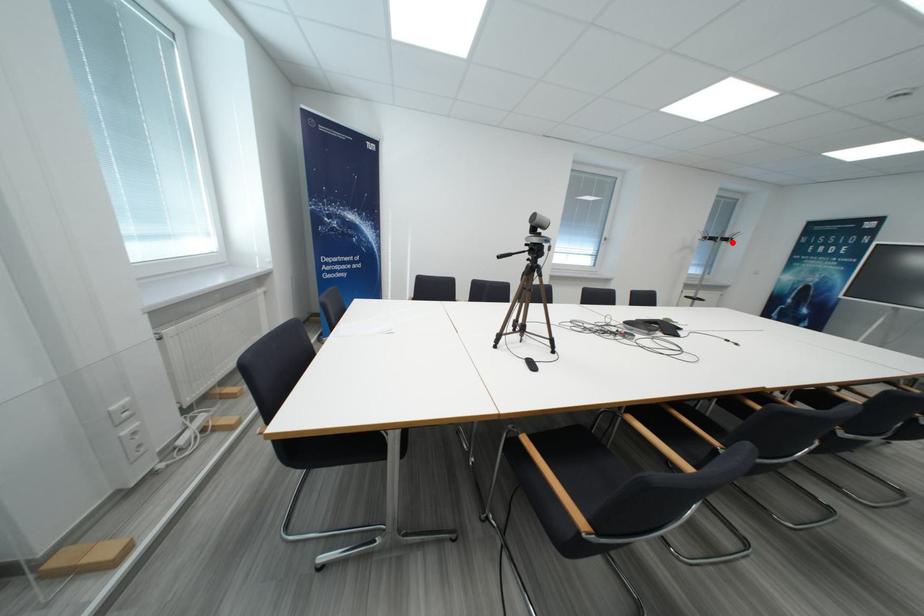
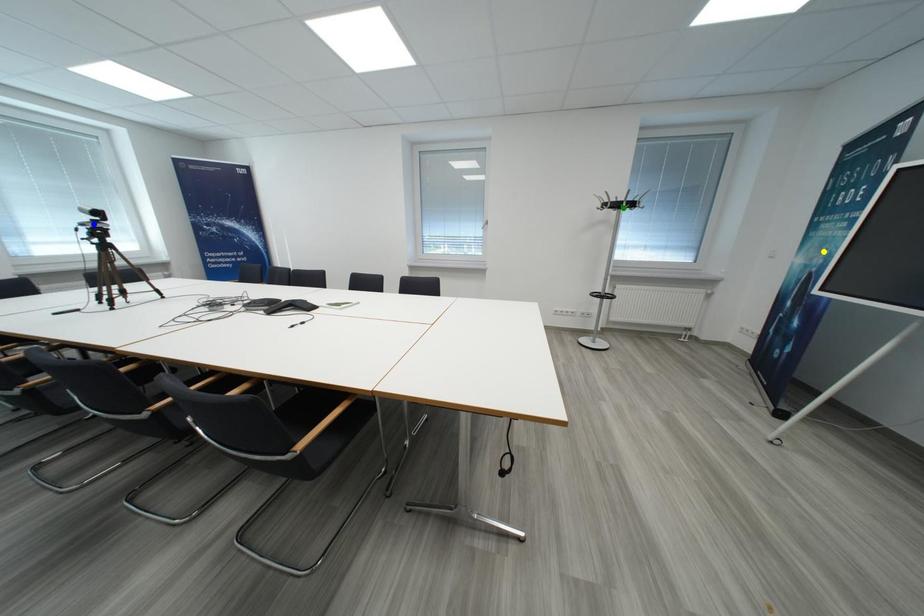
Question: I am providing you with two images of the same scene from different viewpoints. A red point is marked on the first image. You are given multiple points on the second image. Can you choose the point in image 2 that corresponds to the point in image 1?

Choices:
 (A) green point
 (B) yellow point
 (C) blue point

Answer: (A)